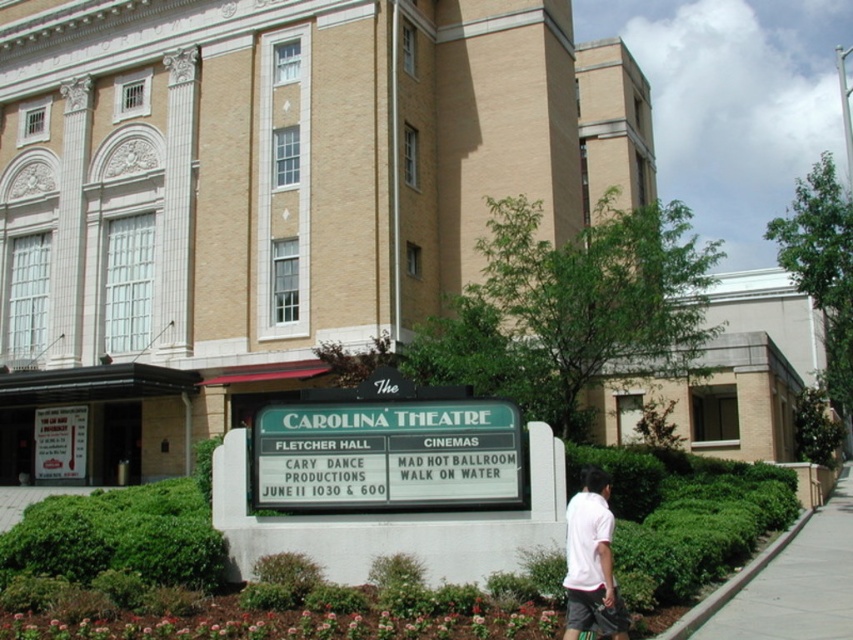
Question: Which point is closer to the camera?

Choices:
 (A) green grass at lower left
 (B) white paper menu at lower left
 (C) concrete sidewalk at lower right
 (D) white cotton shirt at lower right

Answer: (D)

Question: Is green plastic sign at center above green grass at lower left?

Choices:
 (A) yes
 (B) no

Answer: (A)

Question: Which point is closer to the camera?

Choices:
 (A) green grass at lower left
 (B) green plastic sign at center
 (C) white paper menu at lower left
 (D) white cotton shirt at lower right

Answer: (D)

Question: Is white paper menu at lower left smaller than green grass at lower left?

Choices:
 (A) no
 (B) yes

Answer: (B)

Question: Does green plastic sign at center have a larger size compared to white cotton shirt at lower right?

Choices:
 (A) yes
 (B) no

Answer: (B)

Question: Among these points, which one is nearest to the camera?

Choices:
 (A) coord(405,426)
 (B) coord(712,637)

Answer: (B)